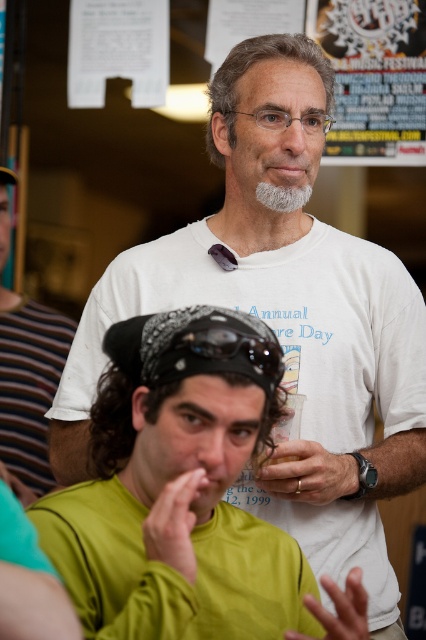
You are at a social event and notice two gray features on a person. The gray hair at upper center and the gray matte beard at center. Which one is positioned more to the left?

The gray hair at upper center is positioned more to the left than the gray matte beard at center.